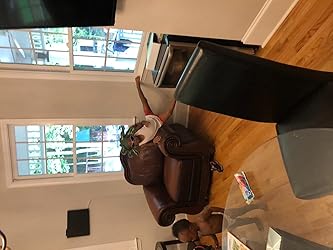
This screenshot has width=333, height=250. What are the coordinates of `feet on window sill` in the screenshot? It's located at (137, 81).